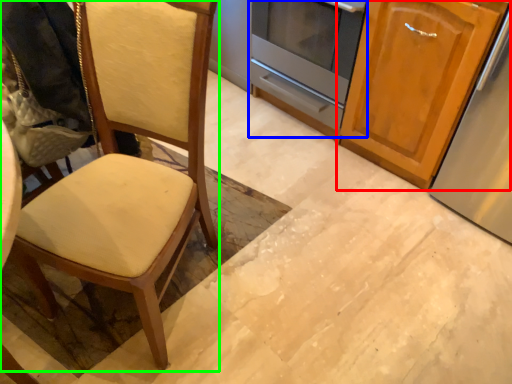
Question: Considering the real-world distances, which object is closest to cabinetry (highlighted by a red box)? oven (highlighted by a blue box) or chair (highlighted by a green box).

Choices:
 (A) oven
 (B) chair

Answer: (A)